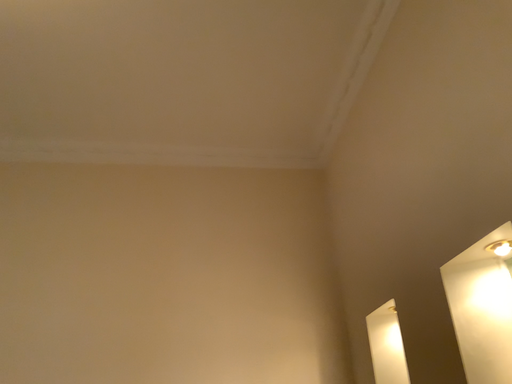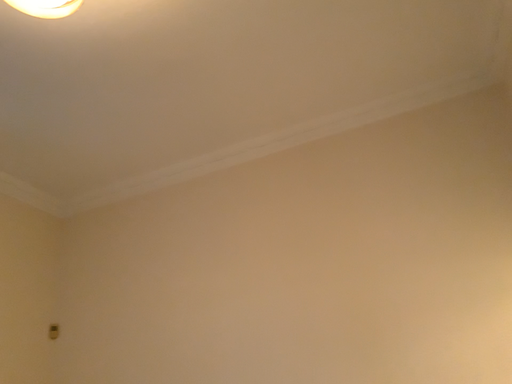
Question: Which way did the camera rotate in the video?

Choices:
 (A) rotated right
 (B) rotated left

Answer: (B)